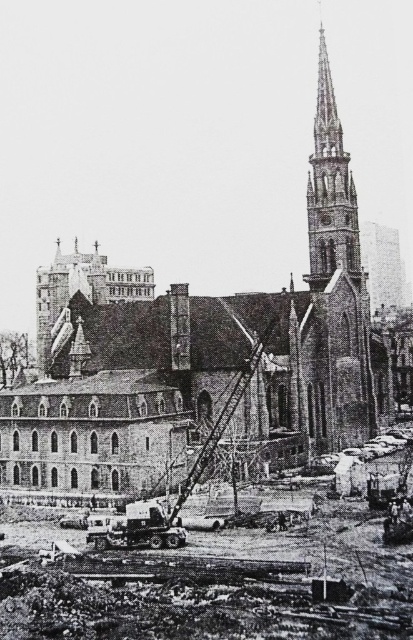
In the scene shown: Between concrete construction site at lower center and polished stone spire at upper right, which one appears on the left side from the viewer's perspective?

concrete construction site at lower center is more to the left.

Can you confirm if concrete construction site at lower center is positioned to the left of polished stone spire at upper right?

Correct, you'll find concrete construction site at lower center to the left of polished stone spire at upper right.

Who is more distant from viewer, (251, 616) or (332, 186)?

The point (332, 186) is behind.

Locate an element on the screen. concrete construction site at lower center is located at coordinates click(x=211, y=582).